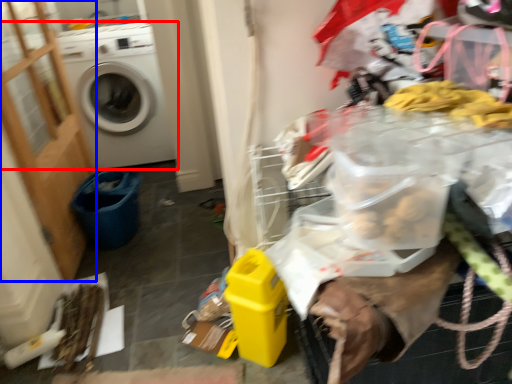
Question: Among these objects, which one is farthest to the camera, washing machine (highlighted by a red box) or screen door (highlighted by a blue box)?

Choices:
 (A) washing machine
 (B) screen door

Answer: (A)